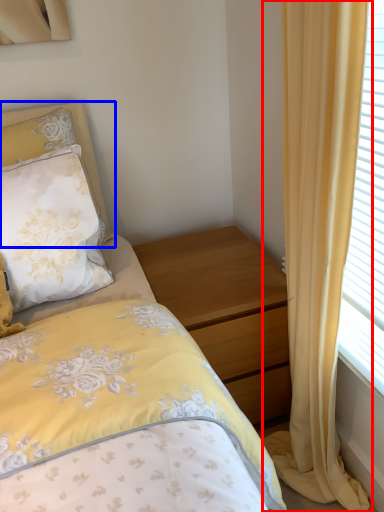
Question: Which object is closer to the camera taking this photo, curtain (highlighted by a red box) or pillow (highlighted by a blue box)?

Choices:
 (A) curtain
 (B) pillow

Answer: (A)